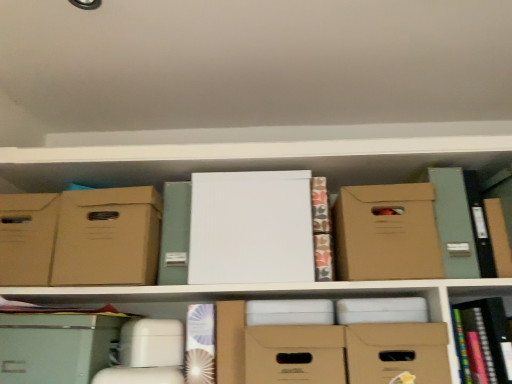
Question: Relative to white paper at center, which is the 2th book in right-to-left order, is matte brown cardboard box at center-right, which is the 2th cardboard box in left-to-right order, in front or behind?

Choices:
 (A) behind
 (B) front

Answer: (B)

Question: From the image's perspective, is matte brown cardboard box at center-right, which is the 2th cardboard box in left-to-right order, positioned above or below white paper at center, which is the 2th book in right-to-left order?

Choices:
 (A) above
 (B) below

Answer: (A)

Question: Estimate the real-world distances between objects in this image. Which object is closer to the multicolored hardcover book at lower right, which is the 2th book from left to right?

Choices:
 (A) white paper at center, the second paperback book positioned from the right
 (B) matte cardboard box at center, the second storage box in the right-to-left sequence
 (C) matte brown cardboard box at left, the 2th cardboard box in the right-to-left sequence
 (D) matte cardboard box at left, acting as the fourth storage box starting from the right
 (E) white paper at center, which is the 2th book in right-to-left order

Answer: (B)

Question: Based on their relative distances, which object is nearer to the white paper at center, the 1th paperback book in the left-to-right sequence?

Choices:
 (A) matte brown cardboard box at center-right, which is the 2th cardboard box in left-to-right order
 (B) matte cardboard box at left, which is the 1th storage box in left-to-right order
 (C) matte brown cardboard box at left, the 2th cardboard box in the right-to-left sequence
 (D) matte cardboard box at center, arranged as the 3th storage box when viewed from the left
 (E) matte cardboard box at lower center, the first storage box in the right-to-left sequence

Answer: (C)